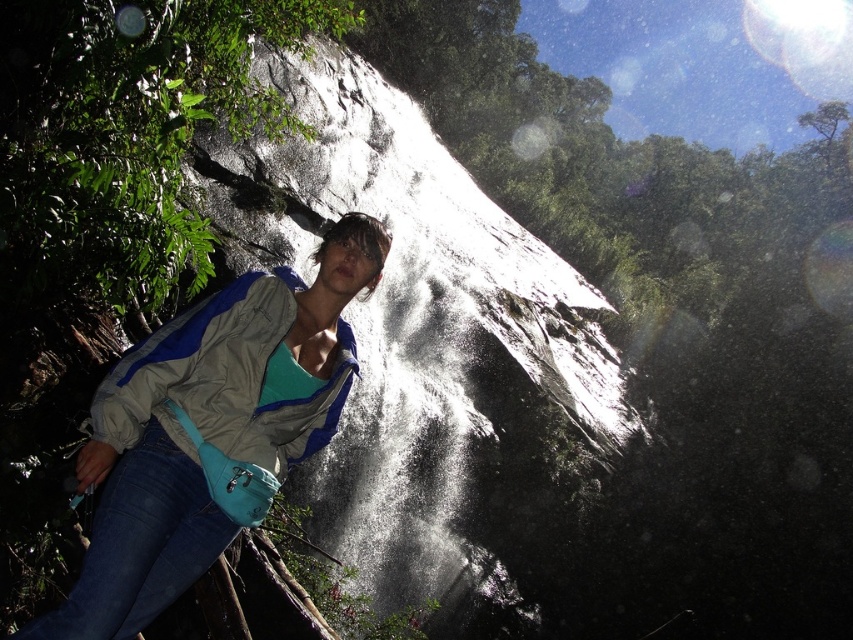
You are a photographer trying to capture the waterfall in the background while ensuring both the matte blue jacket at center and denim at left are visible in the frame. Based on their positions, which object should you focus on first to ensure both are in the same shot?

The matte blue jacket at center is located above denim at left, so you should focus on the denim at left first to ensure both objects are within the frame.